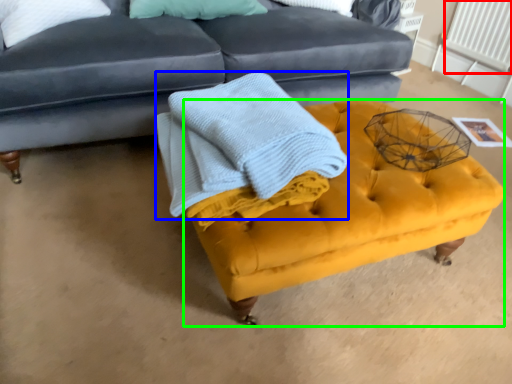
Question: Which is nearer to the radiator (highlighted by a red box)? blanket (highlighted by a blue box) or swivel chair (highlighted by a green box).

Choices:
 (A) blanket
 (B) swivel chair

Answer: (B)